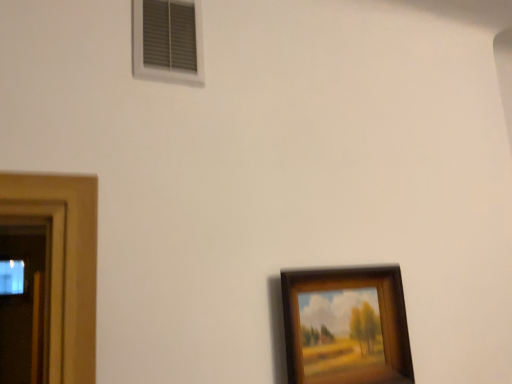
Question: Is wooden framed painting at lower right in front of or behind white plastic vent at upper left in the image?

Choices:
 (A) behind
 (B) front

Answer: (B)

Question: From a real-world perspective, is wooden framed painting at lower right physically located above or below white plastic vent at upper left?

Choices:
 (A) below
 (B) above

Answer: (A)

Question: Is wooden framed painting at lower right wider or thinner than white plastic vent at upper left?

Choices:
 (A) thin
 (B) wide

Answer: (B)

Question: Is white plastic vent at upper left in front of or behind wooden framed painting at lower right in the image?

Choices:
 (A) front
 (B) behind

Answer: (B)

Question: Based on their positions, is white plastic vent at upper left located to the left or right of wooden framed painting at lower right?

Choices:
 (A) right
 (B) left

Answer: (B)

Question: Considering the positions of white plastic vent at upper left and wooden framed painting at lower right in the image, is white plastic vent at upper left wider or thinner than wooden framed painting at lower right?

Choices:
 (A) thin
 (B) wide

Answer: (A)

Question: Is white plastic vent at upper left situated inside wooden framed painting at lower right or outside?

Choices:
 (A) inside
 (B) outside

Answer: (B)